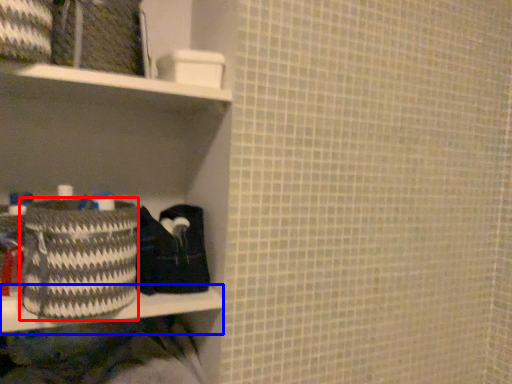
Question: Which of the following is the farthest to the observer, basket (highlighted by a red box) or ledge (highlighted by a blue box)?

Choices:
 (A) basket
 (B) ledge

Answer: (B)